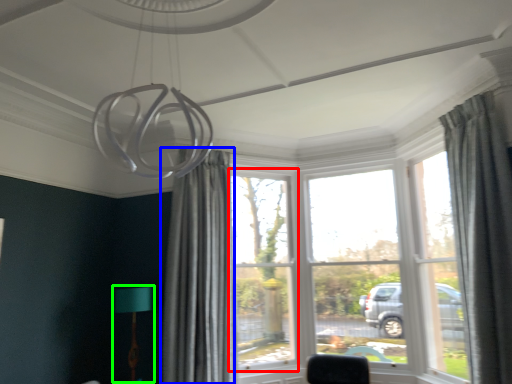
Question: Which object is positioned farthest from window (highlighted by a red box)? Select from curtain (highlighted by a blue box) and table lamp (highlighted by a green box).

Choices:
 (A) curtain
 (B) table lamp

Answer: (B)